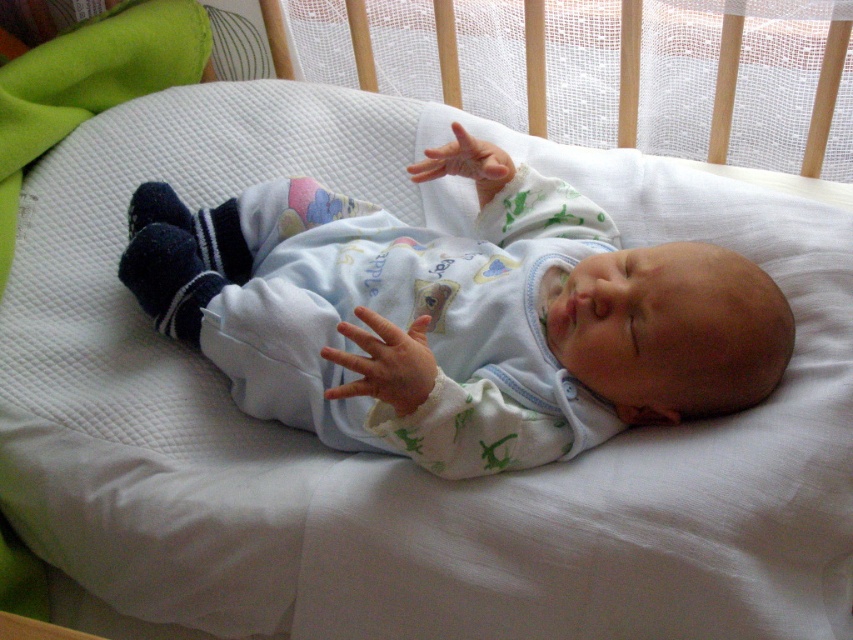
You are a parent trying to place a small toy on the white soft fabric hand at center where the baby can easily reach it. Based on the baby bouncer setup shown, can you confirm if the toy will be within the baby bouncer area?

The white soft fabric hand at center is located at coordinates point [386,362], which is within the baby bouncer area. Therefore, placing the toy there will ensure the baby can reach it.

You are a caregiver checking the safety of the baby setup. The baby is lying on a white padded surface. You notice the white soft baby at center and the white soft fabric hand at center. Based on their sizes, which one is wider?

The white soft baby at center is wider than the white soft fabric hand at center.

You are a parent holding a small toy that needs to be placed exactly 36.11 inches away from where you are standing. You see the point at coordinates point (x=581, y=433) in the image. Can you place the toy at that point to meet the required distance?

Yes, placing the toy at point (x=581, y=433) will satisfy the requirement since the distance between that point and the viewer is exactly 36.11 inches.